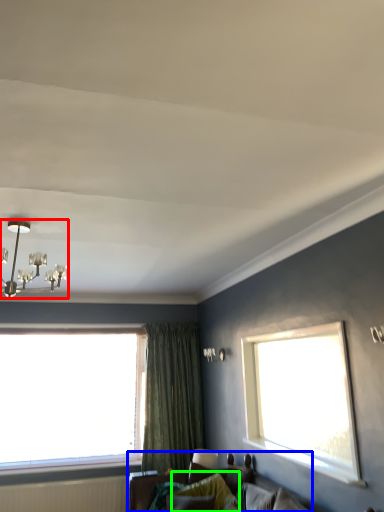
Question: Which is farther away from light fixture (highlighted by a red box)? studio couch (highlighted by a blue box) or pillow (highlighted by a green box)?

Choices:
 (A) studio couch
 (B) pillow

Answer: (B)